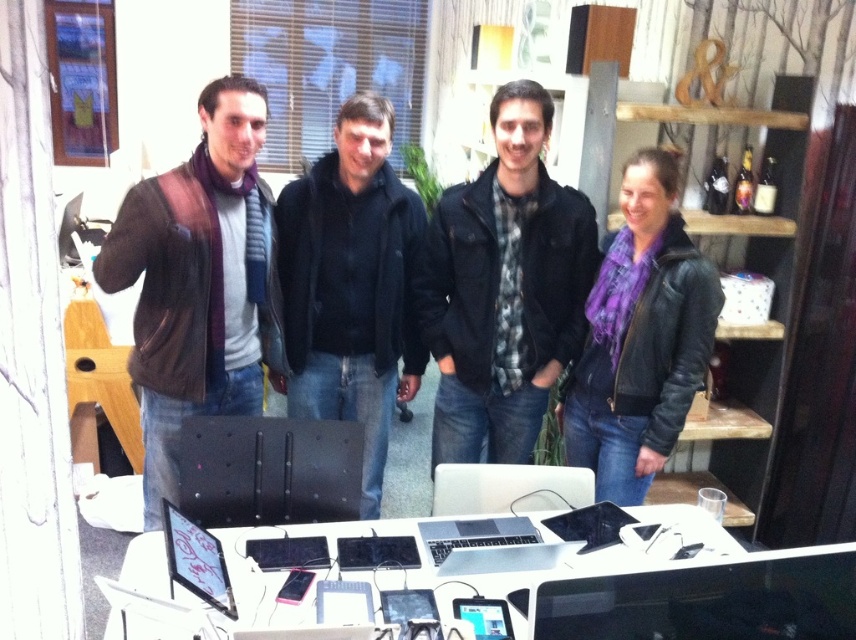
Question: Estimate the real-world distances between objects in this image. Which object is farther from the purple leather jacket at right?

Choices:
 (A) black matte computer at center
 (B) black matte jacket at center

Answer: (A)

Question: Which point appears closest to the camera in this image?

Choices:
 (A) (684, 576)
 (B) (415, 534)
 (C) (387, 344)
 (D) (236, 188)

Answer: (A)

Question: Can you confirm if matte brown leather jacket at left is thinner than purple leather jacket at right?

Choices:
 (A) no
 (B) yes

Answer: (A)

Question: Is matte brown leather jacket at left positioned in front of purple leather jacket at right?

Choices:
 (A) yes
 (B) no

Answer: (A)

Question: Based on their relative distances, which object is farther from the black matte jacket at center?

Choices:
 (A) black matte computer at center
 (B) black glossy monitor at center
 (C) white glossy table at lower center
 (D) matte brown leather jacket at left

Answer: (B)

Question: Does white glossy table at lower center have a lesser width compared to black glossy monitor at center?

Choices:
 (A) no
 (B) yes

Answer: (A)